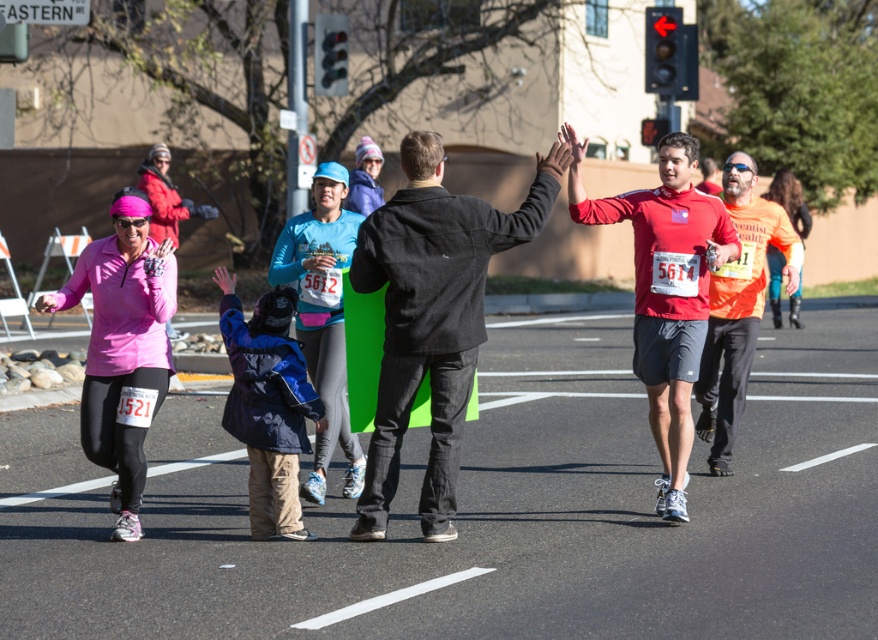
You are a photographer at the marathon event. You want to take a photo that includes both the dark gray jacket at center and the matte red shirt at center. Which object should you focus on first to ensure both are in the frame?

The dark gray jacket at center is positioned under the matte red shirt at center, so you should focus on the matte red shirt at center first to ensure both are in the frame.

You are a photographer positioned at the starting line of the marathon. You want to take a photo that includes both the dark gray jacket at center and the orange fabric shirt at right. Which one should you adjust your camera focus to prioritize if you want the closer object to be in sharp focus?

The dark gray jacket at center is closer to the viewer than the orange fabric shirt at right, so you should prioritize focusing on the dark gray jacket at center to ensure it is in sharp focus.